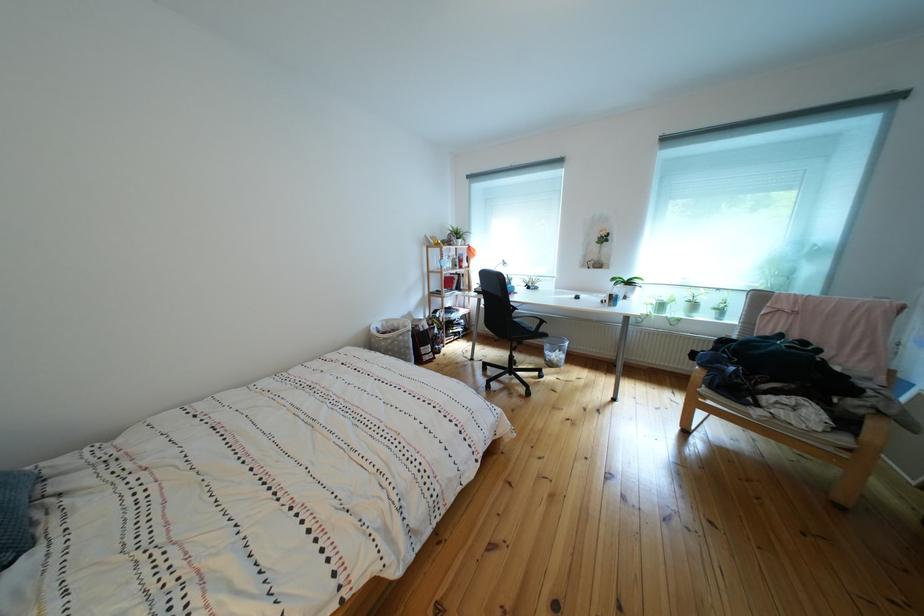
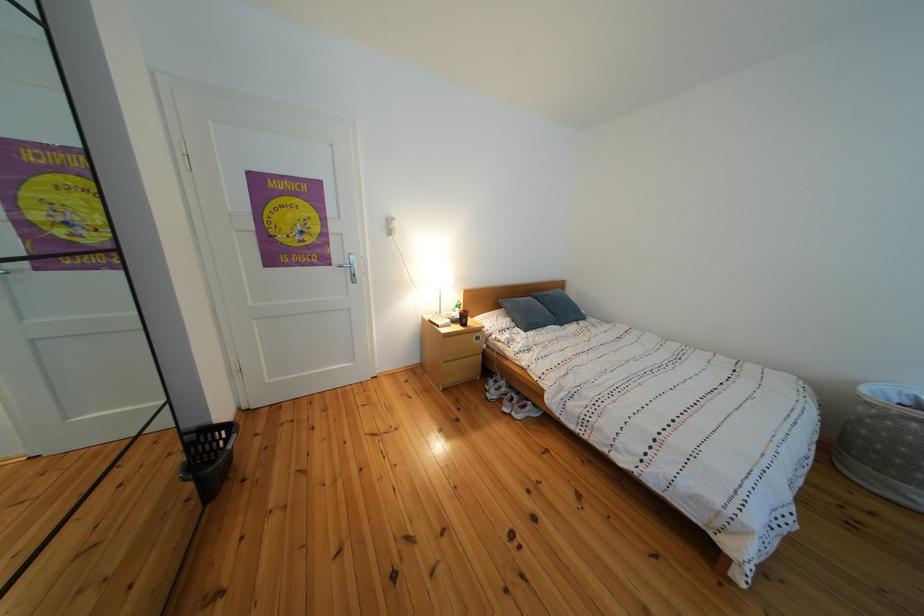
Locate, in the second image, the point that corresponds to (x=386, y=338) in the first image.

(890, 398)